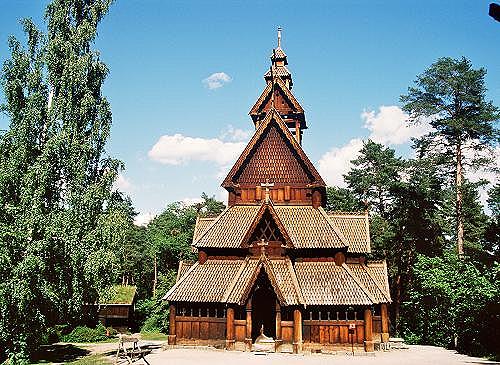
At what (x,y) coordinates should I click in order to perform the action: click on door. Please return your answer as a coordinate pair (x, y). The width and height of the screenshot is (500, 365). Looking at the image, I should click on (262, 308).